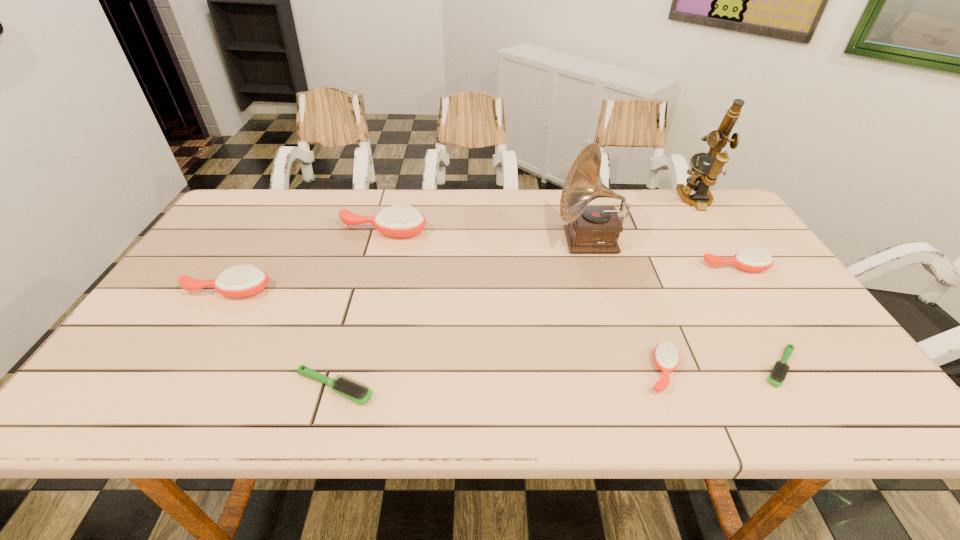
The height and width of the screenshot is (540, 960). Identify the location of object located at the far right corner. (703, 176).

Find the location of a particular element. The width and height of the screenshot is (960, 540). object present at the near right corner is located at coordinates (777, 377).

The height and width of the screenshot is (540, 960). Find the location of `free region at the far edge of the desktop`. free region at the far edge of the desktop is located at coordinates (492, 190).

Locate an element on the screen. Image resolution: width=960 pixels, height=540 pixels. free spot at the near edge of the desktop is located at coordinates (230, 399).

At what (x,y) coordinates should I click in order to perform the action: click on vacant area at the left edge of the desktop. Please return your answer as a coordinate pair (x, y). Looking at the image, I should click on (184, 315).

This screenshot has height=540, width=960. In the image, there is a desktop. Identify the location of free space at the right edge. (756, 322).

At what (x,y) coordinates should I click in order to perform the action: click on vacant area at the near right corner. Please return your answer as a coordinate pair (x, y). The width and height of the screenshot is (960, 540). Looking at the image, I should click on (816, 414).

Identify the location of free space that is in between the farthest object and the third farthest orange hairbrush. (462, 246).

Where is `vacant space in between the smallest orange hairbrush and the third smallest orange hairbrush`? This screenshot has height=540, width=960. vacant space in between the smallest orange hairbrush and the third smallest orange hairbrush is located at coordinates (444, 331).

Where is `vacant space that's between the nearest orange hairbrush and the right light hairbrush`? Image resolution: width=960 pixels, height=540 pixels. vacant space that's between the nearest orange hairbrush and the right light hairbrush is located at coordinates (722, 369).